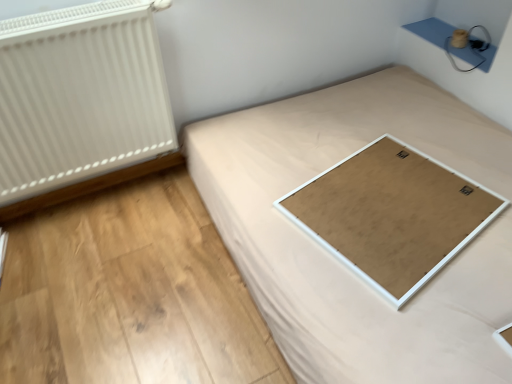
This screenshot has width=512, height=384. Identify the location of vacant region above white matte board at center (from a real-world perspective). (385, 200).